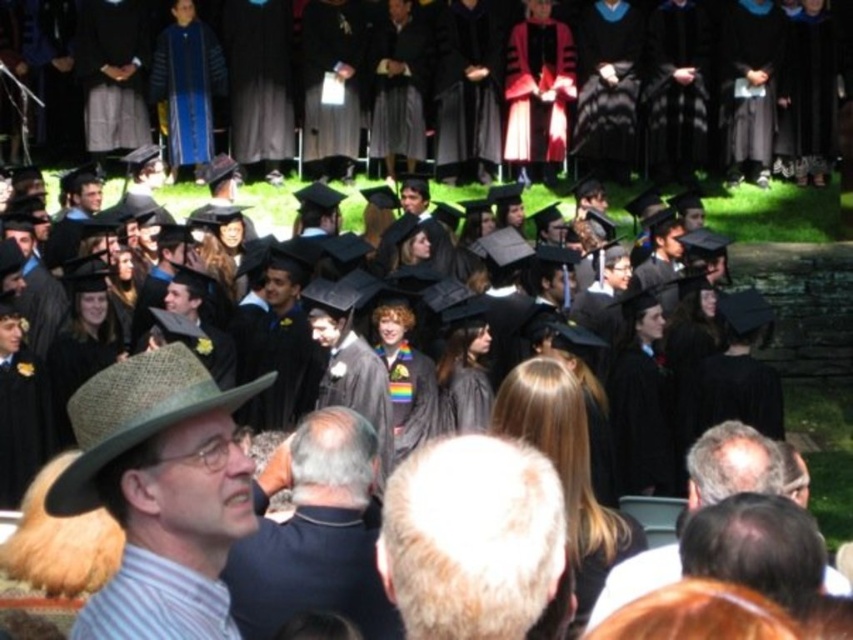
Does brown straw hat at left have a greater height compared to dark blue shirt at center?

Correct, brown straw hat at left is much taller as dark blue shirt at center.

Does brown straw hat at left have a larger size compared to dark blue shirt at center?

Actually, brown straw hat at left might be smaller than dark blue shirt at center.

Image resolution: width=853 pixels, height=640 pixels. What do you see at coordinates (160, 493) in the screenshot?
I see `brown straw hat at left` at bounding box center [160, 493].

Find the location of a particular element. This screenshot has width=853, height=640. brown straw hat at left is located at coordinates (160, 493).

Can you confirm if white hair at center is positioned to the left of gray hair at center?

Yes, white hair at center is to the left of gray hair at center.

Which is below, white hair at center or gray hair at center?

gray hair at center is below.

Is point (442, 454) closer to viewer compared to point (724, 442)?

Yes, it is.

In order to click on white hair at center in this screenshot , I will do `click(471, 538)`.

Between white hair at center and dark blue shirt at center, which one has more height?

dark blue shirt at center is taller.

Between point (521, 547) and point (337, 577), which one is positioned behind?

Positioned behind is point (337, 577).

Image resolution: width=853 pixels, height=640 pixels. Find the location of `white hair at center`. white hair at center is located at coordinates (471, 538).